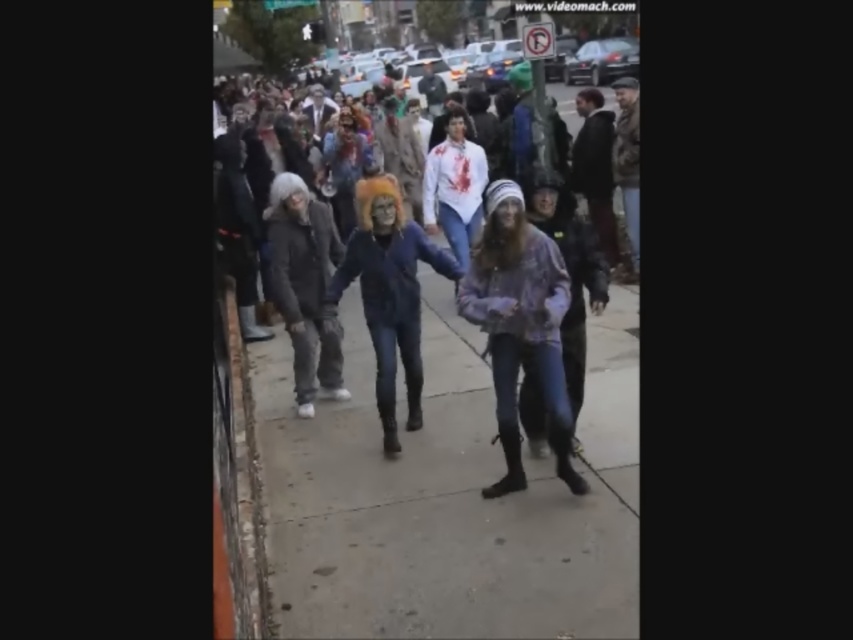
Who is taller, concrete sidewalk at center or orange fuzzy hat at center?

With more height is orange fuzzy hat at center.

Which of these two, concrete sidewalk at center or orange fuzzy hat at center, stands shorter?

Standing shorter between the two is concrete sidewalk at center.

Identify the location of concrete sidewalk at center. (427, 509).

In the scene shown: Can you confirm if concrete sidewalk at center is positioned to the left of denim jacket at center?

Correct, you'll find concrete sidewalk at center to the left of denim jacket at center.

Is point (279, 472) farther from viewer compared to point (625, 452)?

That is True.

Locate an element on the screen. concrete sidewalk at center is located at coordinates (427, 509).

Locate an element on the screen. concrete sidewalk at center is located at coordinates (427, 509).

Does concrete sidewalk at center have a greater width compared to plaid fabric jacket at center?

Yes.

Looking at this image, can you confirm if concrete sidewalk at center is smaller than plaid fabric jacket at center?

Incorrect, concrete sidewalk at center is not smaller in size than plaid fabric jacket at center.

Identify the location of concrete sidewalk at center. (427, 509).

The image size is (853, 640). I want to click on concrete sidewalk at center, so click(x=427, y=509).